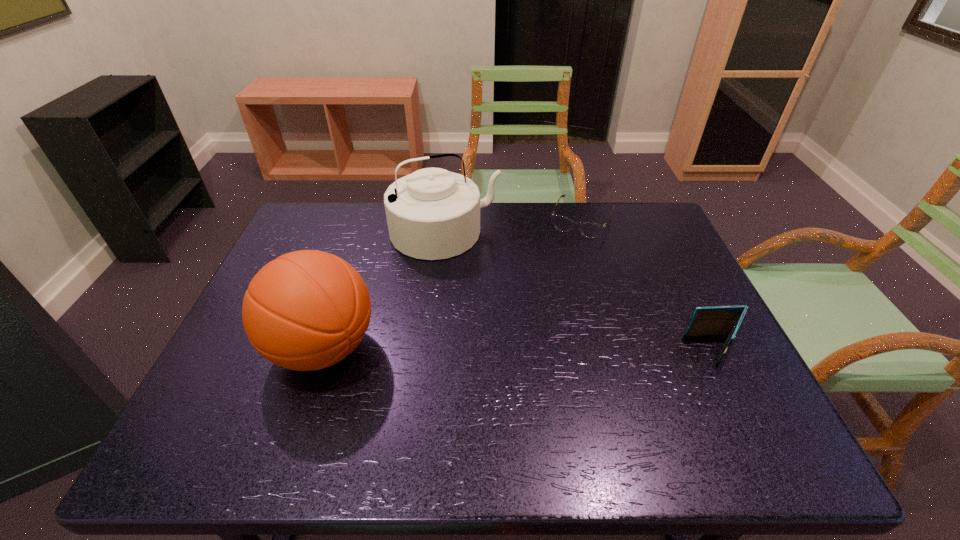
Where is `wallet located at the right edge`? wallet located at the right edge is located at coordinates (718, 320).

You are a GUI agent. You are given a task and a screenshot of the screen. Output one action in this format:
    pyautogui.click(x=<x>, y=<y>)
    Task: Click on the spectacles that is at the right edge
    
    Given the screenshot: What is the action you would take?
    pyautogui.click(x=591, y=230)

This screenshot has height=540, width=960. Identify the location of object present at the near left corner. (306, 310).

Locate an element on the screen. This screenshot has height=540, width=960. object that is at the far right corner is located at coordinates (591, 230).

In the image, there is a desktop. In order to click on vacant space at the far edge in this screenshot , I will do `click(513, 204)`.

Find the location of a particular element. free spot at the near edge of the desktop is located at coordinates (404, 384).

I want to click on free space at the left edge, so click(x=252, y=370).

Find the location of a particular element. This screenshot has height=540, width=960. vacant space at the right edge is located at coordinates (689, 267).

The height and width of the screenshot is (540, 960). In order to click on vacant area at the far left corner in this screenshot , I will do `click(297, 218)`.

I want to click on free space at the near left corner, so click(207, 389).